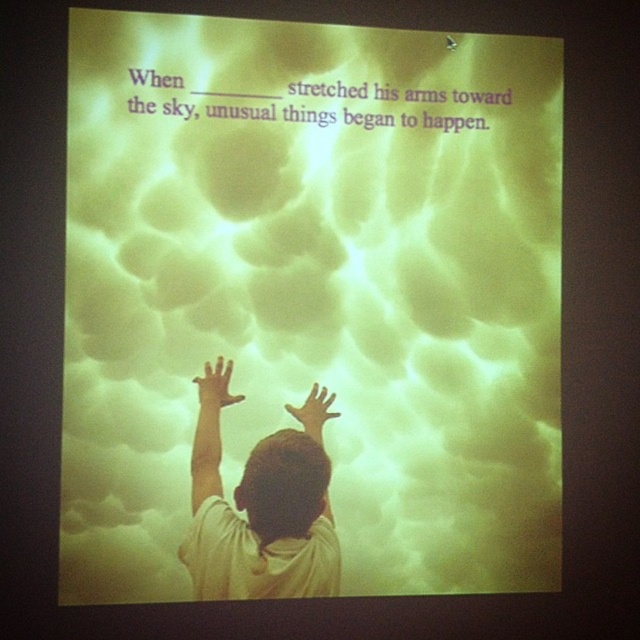
Based on the photo, is white matte shirt at lower center positioned behind matte yellow hand at center?

That is False.

Who is taller, white matte shirt at lower center or matte yellow hand at center?

Standing taller between the two is white matte shirt at lower center.

Which is in front, point (304, 486) or point (323, 394)?

Point (304, 486) is more forward.

At what (x,y) coordinates should I click in order to perform the action: click on white matte shirt at lower center. Please return your answer as a coordinate pair (x, y). Looking at the image, I should click on (260, 506).

Does matte yellow hand at upper center have a greater width compared to matte yellow hand at center?

No.

Does matte yellow hand at upper center have a lesser height compared to matte yellow hand at center?

Yes.

This screenshot has height=640, width=640. In order to click on matte yellow hand at upper center in this screenshot , I will do `click(216, 385)`.

Can you confirm if white matte shirt at lower center is wider than matte yellow hand at upper center?

Yes.

This screenshot has height=640, width=640. Describe the element at coordinates (260, 506) in the screenshot. I see `white matte shirt at lower center` at that location.

You are a GUI agent. You are given a task and a screenshot of the screen. Output one action in this format:
    pyautogui.click(x=<x>, y=<y>)
    Task: Click on the white matte shirt at lower center
    The width and height of the screenshot is (640, 640).
    Given the screenshot: What is the action you would take?
    pyautogui.click(x=260, y=506)